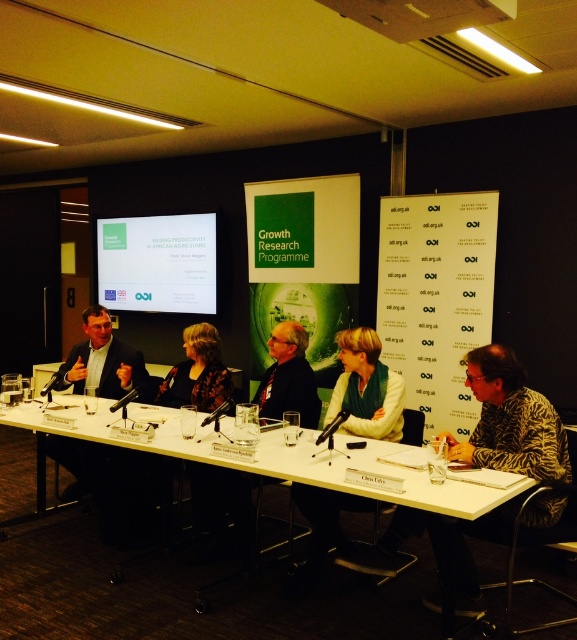
Does white plastic table at center have a greater height compared to matte black jacket at center?

Correct, white plastic table at center is much taller as matte black jacket at center.

Is white plastic table at center positioned before matte black jacket at center?

Yes, it is.

I want to click on white plastic table at center, so click(288, 460).

Can you confirm if white paper at center is smaller than matte black jacket at center?

No.

You are a GUI agent. You are given a task and a screenshot of the screen. Output one action in this format:
    pyautogui.click(x=<x>, y=<y>)
    Task: Click on the white paper at center
    This screenshot has width=577, height=640.
    Given the screenshot: What is the action you would take?
    pyautogui.click(x=436, y=298)

Between point (441, 284) and point (283, 362), which one is positioned behind?

Positioned behind is point (441, 284).

Identify the location of white paper at center. (436, 298).

Does patterned fabric shirt at right appear over floral-patterned blouse at center?

No, patterned fabric shirt at right is not above floral-patterned blouse at center.

Can you confirm if patterned fabric shirt at right is taller than floral-patterned blouse at center?

Indeed, patterned fabric shirt at right has a greater height compared to floral-patterned blouse at center.

The height and width of the screenshot is (640, 577). What do you see at coordinates (511, 420) in the screenshot?
I see `patterned fabric shirt at right` at bounding box center [511, 420].

The image size is (577, 640). Find the location of `patterned fabric shirt at right`. patterned fabric shirt at right is located at coordinates (511, 420).